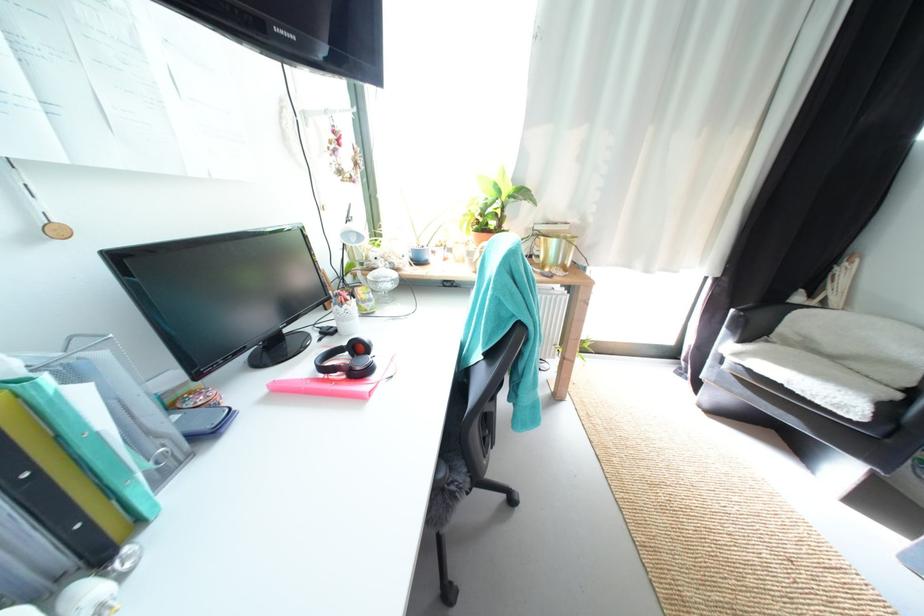
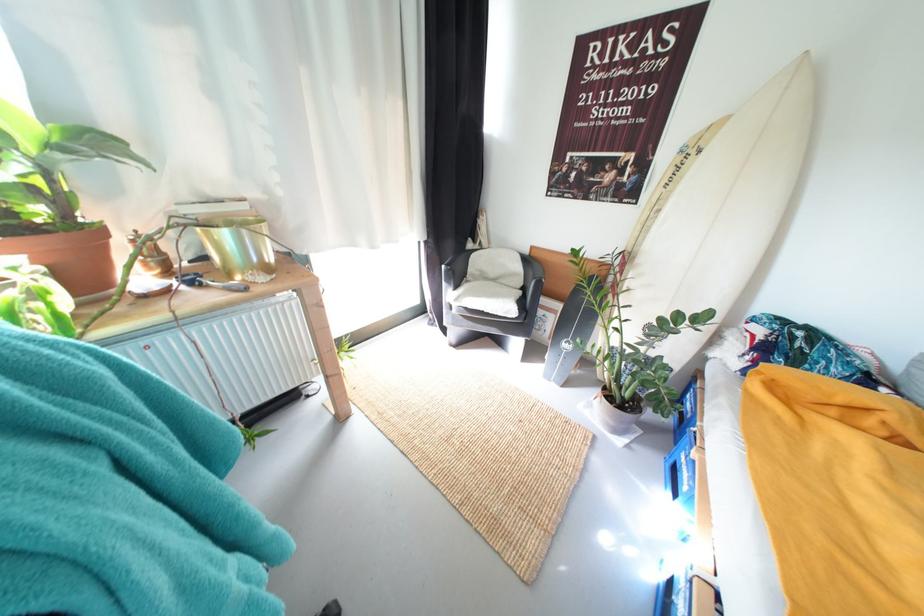
Question: Based on the continuous images, in which direction is the camera rotating? Reply with the corresponding letter.

Choices:
 (A) Left
 (B) Right
 (C) Up
 (D) Down

Answer: (B)